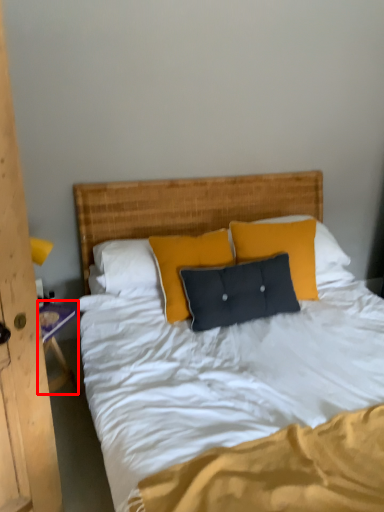
Question: Considering the relative positions of nightstand (annotated by the red box) and pillow in the image provided, where is nightstand (annotated by the red box) located with respect to the staircase?

Choices:
 (A) right
 (B) left

Answer: (B)